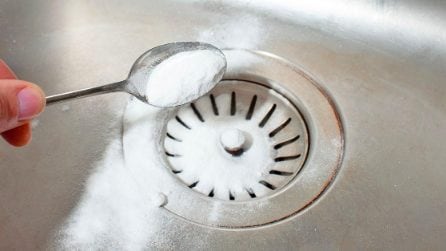
At what (x,y) coordinates should I click in order to perform the action: click on sink. Please return your answer as a coordinate pair (x, y). This screenshot has width=446, height=251. Looking at the image, I should click on (393, 173), (296, 31), (83, 50).